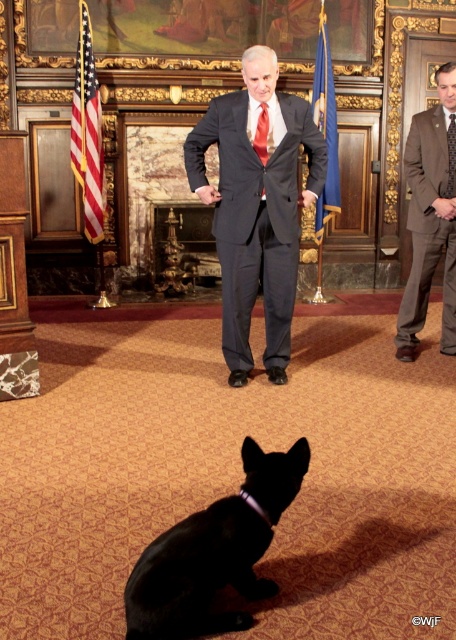
Can you confirm if brown textured suit at right is shorter than black textured tie at right?

No.

Can you confirm if brown textured suit at right is positioned to the right of black textured tie at right?

No, brown textured suit at right is not to the right of black textured tie at right.

What do you see at coordinates (429, 220) in the screenshot? I see `brown textured suit at right` at bounding box center [429, 220].

This screenshot has width=456, height=640. I want to click on brown textured suit at right, so click(429, 220).

Who is positioned more to the right, matte gray suit at center or black textured tie at right?

black textured tie at right is more to the right.

Who is more distant from viewer, (196, 160) or (450, 176)?

Point (450, 176)

Is point (288, 296) positioned behind point (449, 182)?

No, it is in front of (449, 182).

At what (x,y) coordinates should I click in order to perform the action: click on matte gray suit at center. Please return your answer as a coordinate pair (x, y). Looking at the image, I should click on click(257, 208).

The image size is (456, 640). What are the coordinates of `brown textured suit at right` in the screenshot? It's located at (429, 220).

You are a GUI agent. You are given a task and a screenshot of the screen. Output one action in this format:
    pyautogui.click(x=<x>, y=<y>)
    Task: Click on the brown textured suit at right
    This screenshot has height=640, width=456.
    Given the screenshot: What is the action you would take?
    pyautogui.click(x=429, y=220)